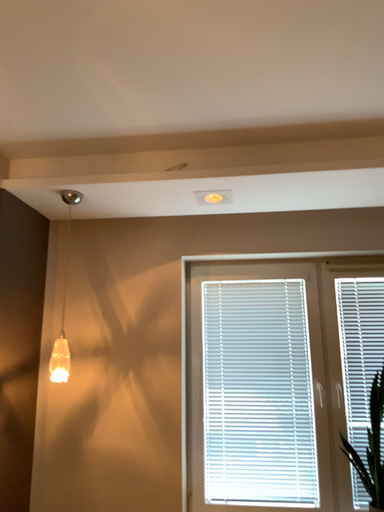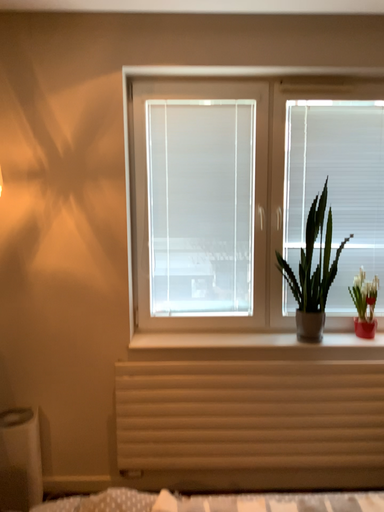
Question: Which way did the camera rotate in the video?

Choices:
 (A) rotated upward
 (B) rotated downward

Answer: (B)